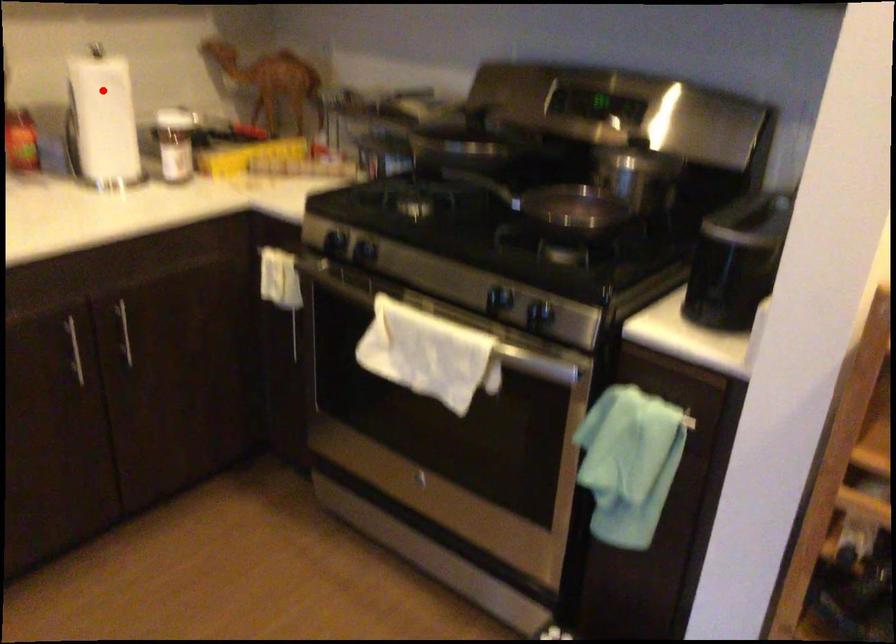
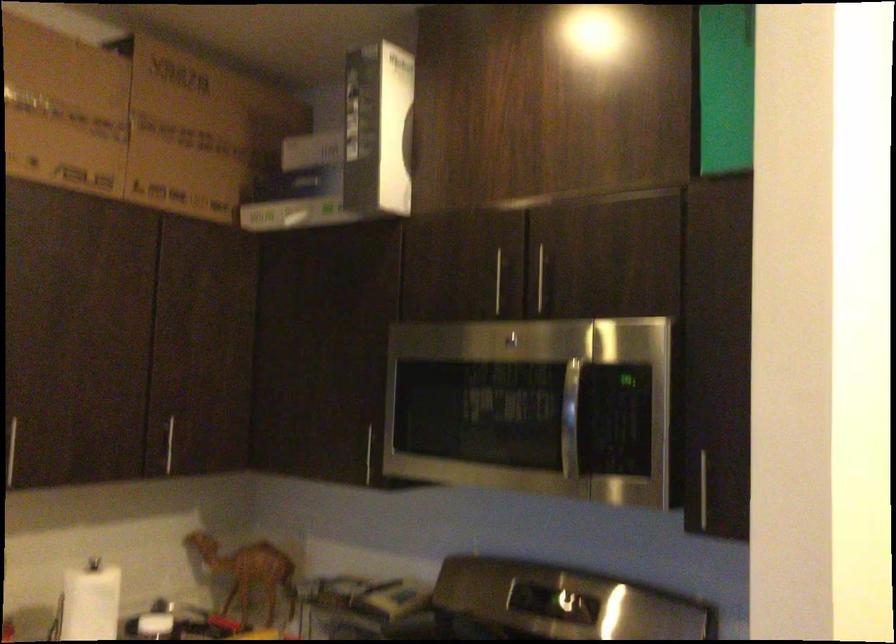
Locate, in the second image, the point that corresponds to the highlighted location in the first image.

(90, 601)